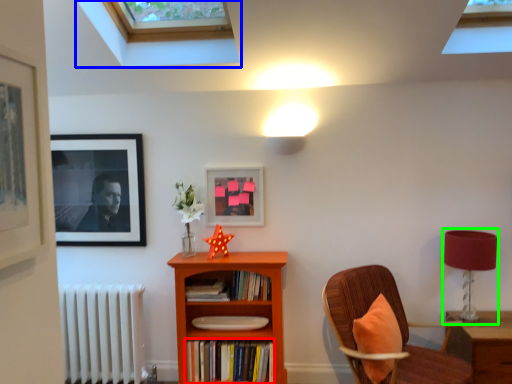
Question: Considering the real-world distances, which object is closest to book (highlighted by a red box)? window (highlighted by a blue box) or table lamp (highlighted by a green box).

Choices:
 (A) window
 (B) table lamp

Answer: (B)